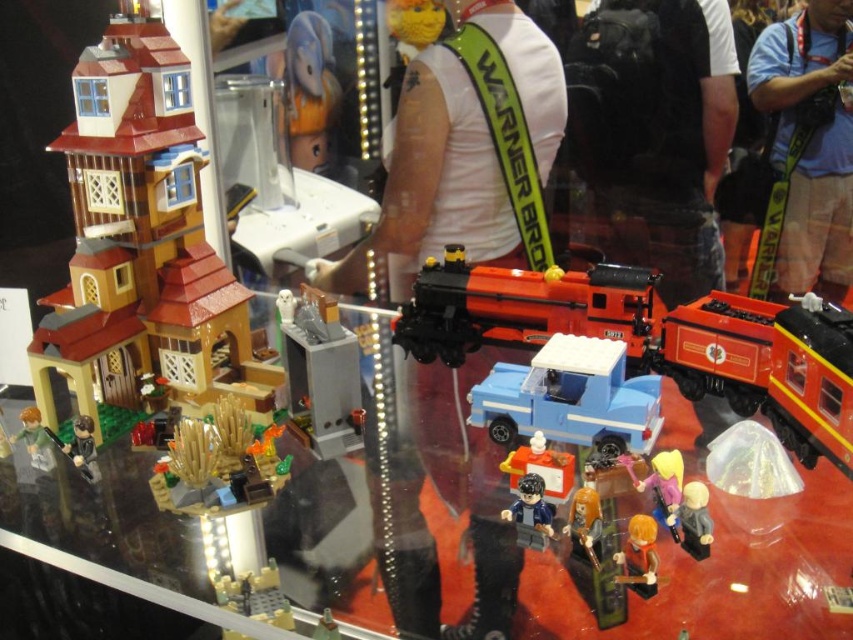
Question: Can you confirm if white fabric warner bros sash at center is positioned to the left of yellow plastic train at lower center?

Choices:
 (A) no
 (B) yes

Answer: (A)

Question: Which point is closer to the camera?

Choices:
 (A) (96, 330)
 (B) (79, 422)
 (C) (357, 269)

Answer: (B)

Question: Based on their relative distances, which object is farther from the brown fabric figure at lower left?

Choices:
 (A) matte brown house at left
 (B) pink matte figure at center
 (C) smooth beige minifigure at lower right
 (D) white fabric warner bros sash at center

Answer: (C)

Question: Which object is closer to the camera taking this photo?

Choices:
 (A) translucent orange minifigure at center
 (B) yellow plastic train at lower center

Answer: (B)

Question: Can you confirm if blue fabric shirt at center is positioned below brown fabric figure at lower left?

Choices:
 (A) no
 (B) yes

Answer: (A)

Question: Where is white fabric warner bros sash at center located in relation to orange plush duck at upper center in the image?

Choices:
 (A) below
 (B) above

Answer: (A)